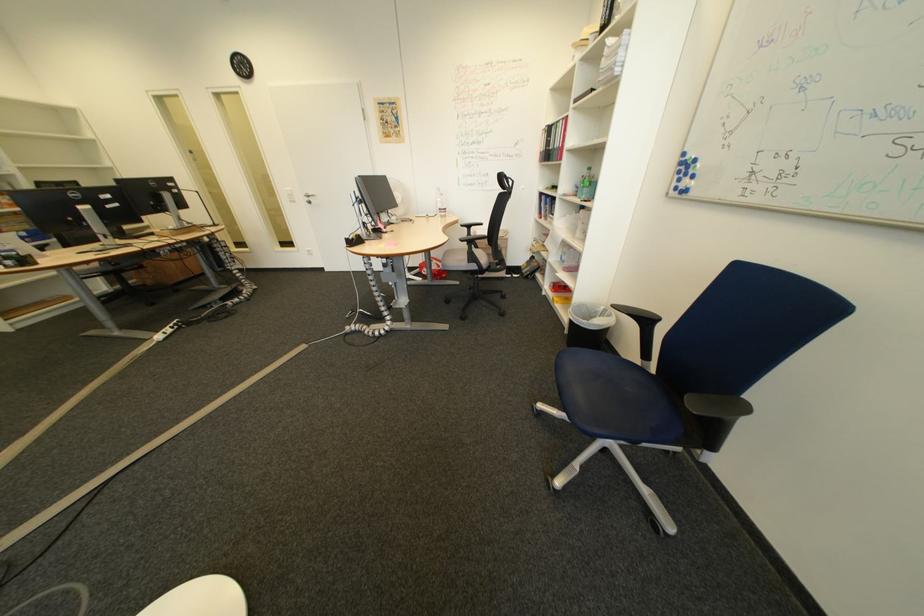
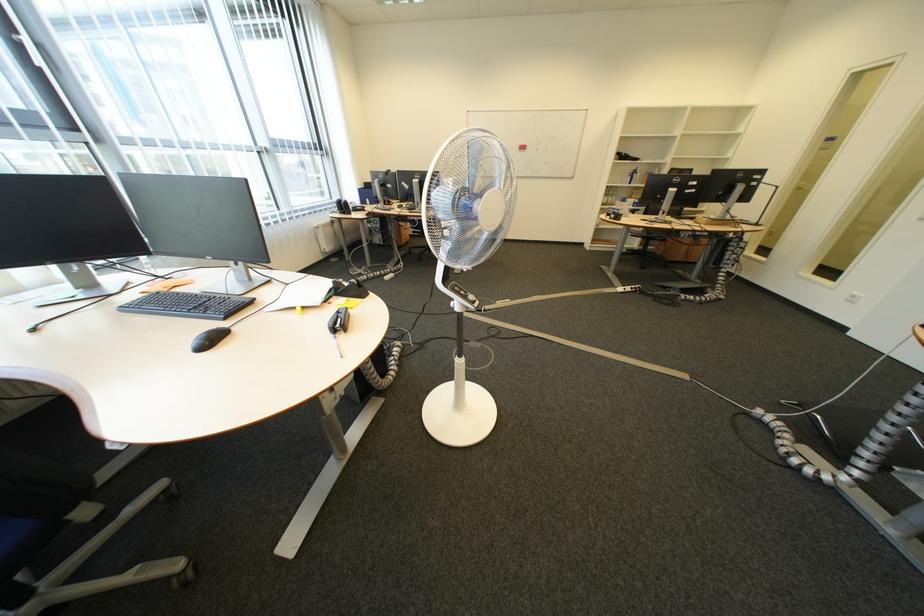
Based on the continuous images, in which direction is the camera rotating?

The rotation direction of the camera is left-down.